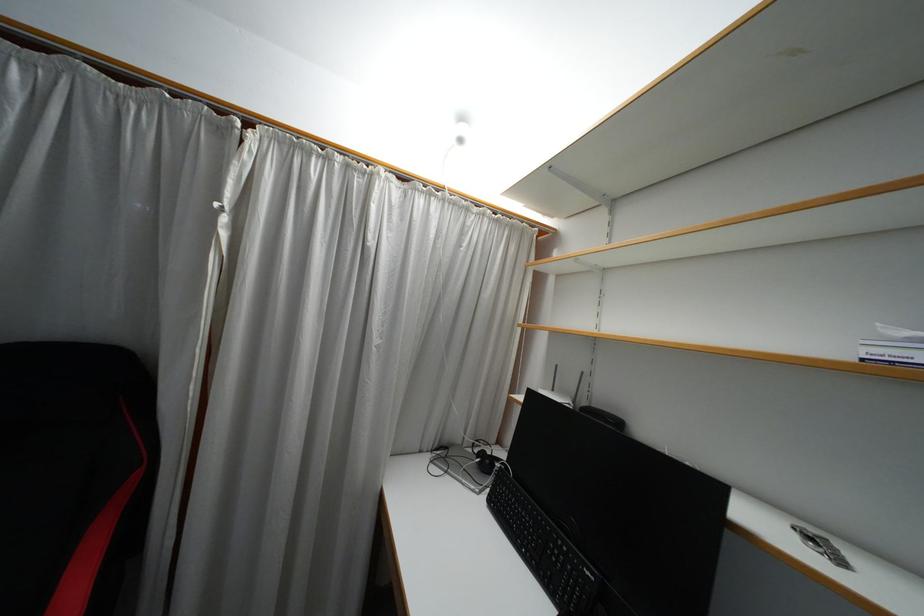
Which object does [544,551] point to?

This point indicates the black keyboard.